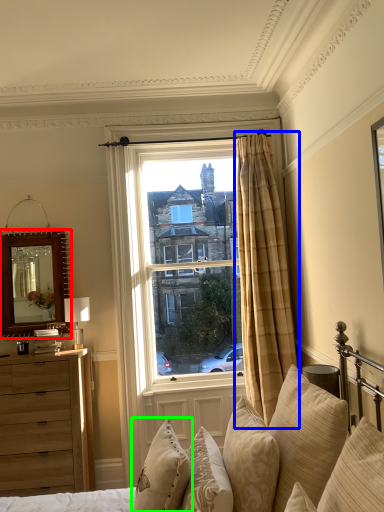
Question: Based on their relative distances, which object is farther from mirror (highlighted by a red box)? Choose from curtain (highlighted by a blue box) and pillow (highlighted by a green box).

Choices:
 (A) curtain
 (B) pillow

Answer: (B)